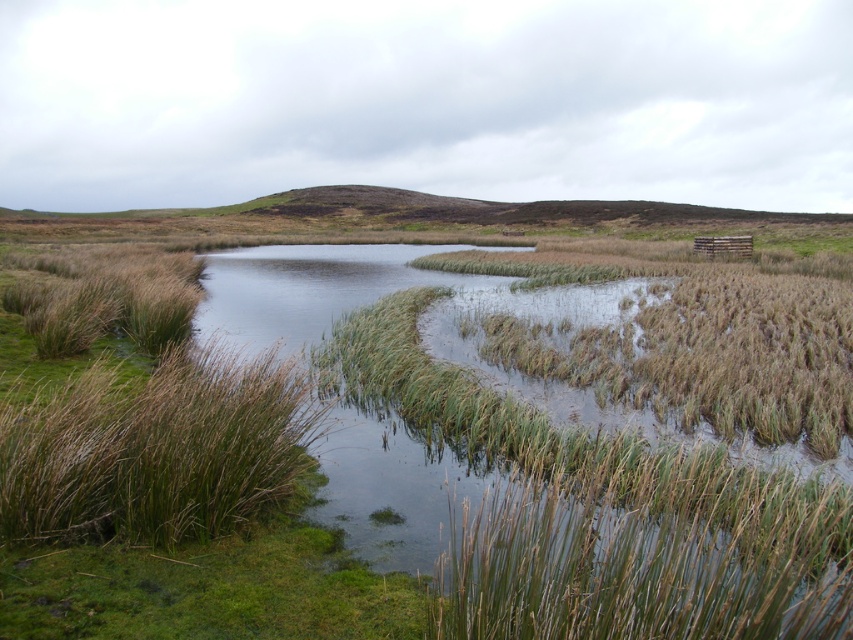
Question: Which of the following is the closest to the observer?

Choices:
 (A) brown grass at lower center
 (B) brown grass at left

Answer: (A)

Question: Where is brown grass at lower center located in relation to brown grass at left in the image?

Choices:
 (A) above
 (B) below

Answer: (B)

Question: Is brown grass at lower center below brown grass at left?

Choices:
 (A) yes
 (B) no

Answer: (A)

Question: Which point is farther to the camera?

Choices:
 (A) brown grass at left
 (B) brown grass at lower center

Answer: (A)

Question: Which object is closer to the camera taking this photo?

Choices:
 (A) brown grass at left
 (B) brown grass at lower center

Answer: (B)

Question: Is brown grass at lower center above brown grass at left?

Choices:
 (A) yes
 (B) no

Answer: (B)